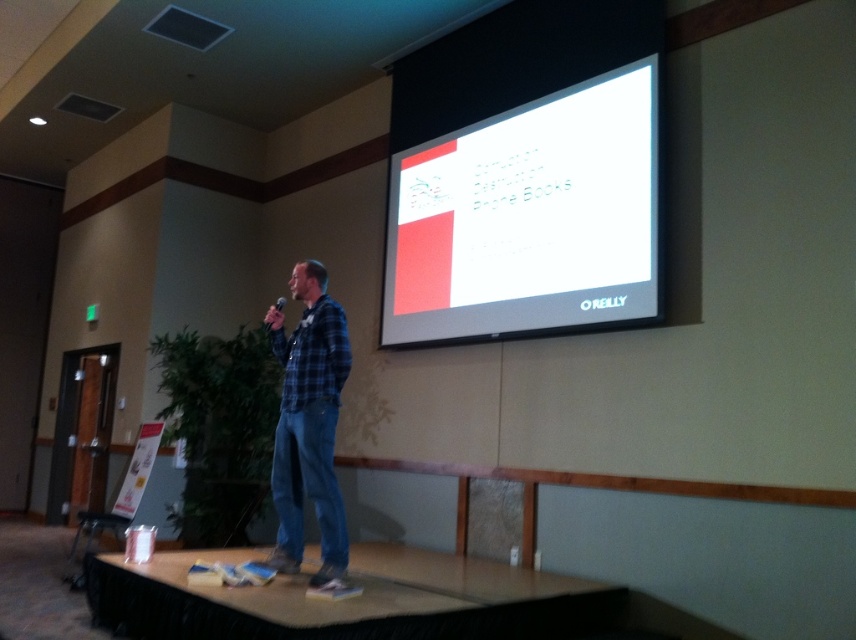
You are a photographer positioned at the back of the stage. You want to capture a closeup shot of the presenter while ensuring both the blue plaid shirt at center and the matte black microphone at center are visible in the frame. Given their sizes, which object will occupy more space in the photo?

The blue plaid shirt at center will occupy more space in the photo because its width surpasses that of the matte black microphone at center, as stated in the description.

You are standing at the back of the stage and want to hand a document to the man wearing the blue plaid shirt at center. If you walk straight towards him, will you be able to reach him within 2 meters?

The blue plaid shirt at center and viewer are 3.46 meters apart, so you will not be able to reach him within 2 meters by walking straight towards him.

You are an event organizer who needs to ensure the presenter can easily reach the white glossy projection screen at upper center from his current position on stage. The presenter is 1.8 meters tall. Can he comfortably reach the screen without moving from his spot?

The presenter is 1.8 meters tall, and the distance between him and the white glossy projection screen at upper center is 3.84 meters. Since the screen is 3.84 meters away, it would be challenging for the presenter to comfortably reach it without moving closer. He would likely need to step forward to interact with the screen effectively.